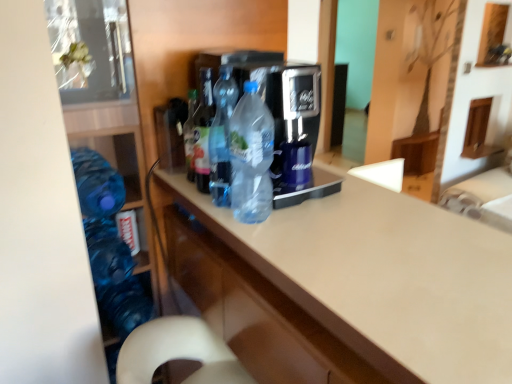
This screenshot has height=384, width=512. Identify the location of vacant region above blue translucent bottle at lower left, which appears as the fourth bottle when viewed from the right (from a real-world perspective). (92, 168).